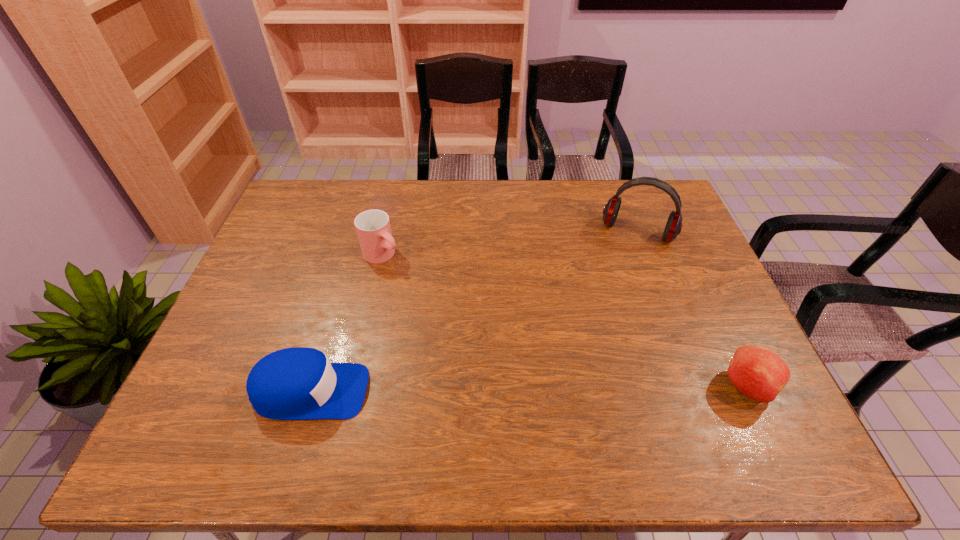
Where is `free region located on the ear cups of the earphone`? The width and height of the screenshot is (960, 540). free region located on the ear cups of the earphone is located at coordinates (620, 271).

What are the coordinates of `vacant area situated 0.100m on the ear cups of the earphone` in the screenshot? It's located at (620, 268).

Image resolution: width=960 pixels, height=540 pixels. Identify the location of object that is at the far edge. (673, 227).

Where is `baseball cap present at the near edge`? The width and height of the screenshot is (960, 540). baseball cap present at the near edge is located at coordinates (298, 383).

Locate an element on the screen. This screenshot has width=960, height=540. apple present at the near edge is located at coordinates (758, 373).

The height and width of the screenshot is (540, 960). What are the coordinates of `object located at the left edge` in the screenshot? It's located at (298, 383).

At what (x,y) coordinates should I click in order to perform the action: click on apple located at the right edge. Please return your answer as a coordinate pair (x, y). Looking at the image, I should click on (758, 373).

I want to click on earphone at the right edge, so click(673, 227).

Where is `object that is at the near left corner`? object that is at the near left corner is located at coordinates (298, 383).

The image size is (960, 540). Identify the location of object present at the far right corner. (673, 227).